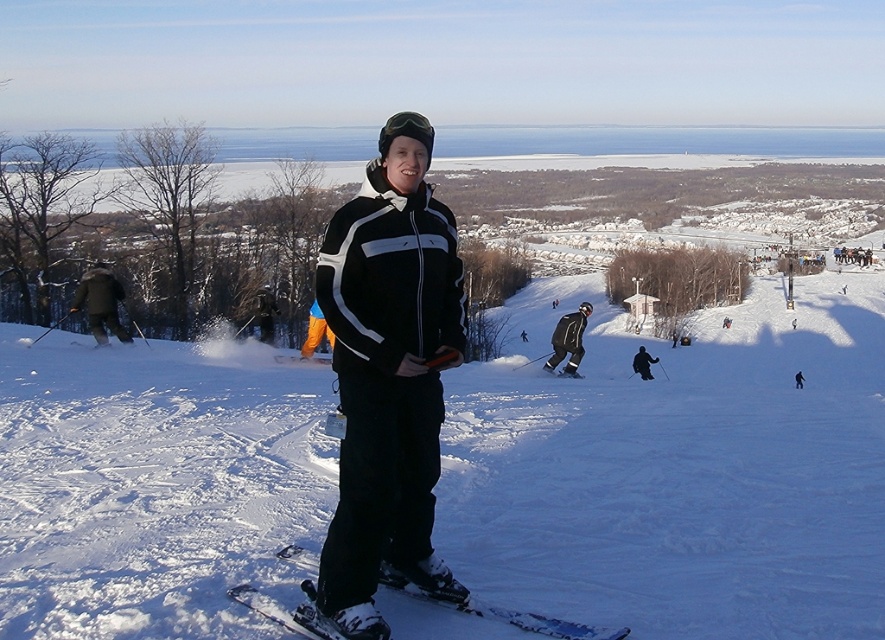
Question: Does white plastic ski at center lie behind black matte ski suit at center?

Choices:
 (A) no
 (B) yes

Answer: (A)

Question: Which point is farther from the camera taking this photo?

Choices:
 (A) (568, 316)
 (B) (397, 461)

Answer: (A)

Question: Which point appears closest to the camera in this image?

Choices:
 (A) (458, 596)
 (B) (556, 618)

Answer: (A)

Question: Does black matte jacket at center appear under black matte ski suit at center?

Choices:
 (A) yes
 (B) no

Answer: (A)

Question: Which of these objects is positioned farthest from the black matte ski suit at center?

Choices:
 (A) black matte jacket at center
 (B) white plastic ski at center

Answer: (B)

Question: Can you confirm if white plastic ski at center is smaller than black matte ski suit at center?

Choices:
 (A) yes
 (B) no

Answer: (A)